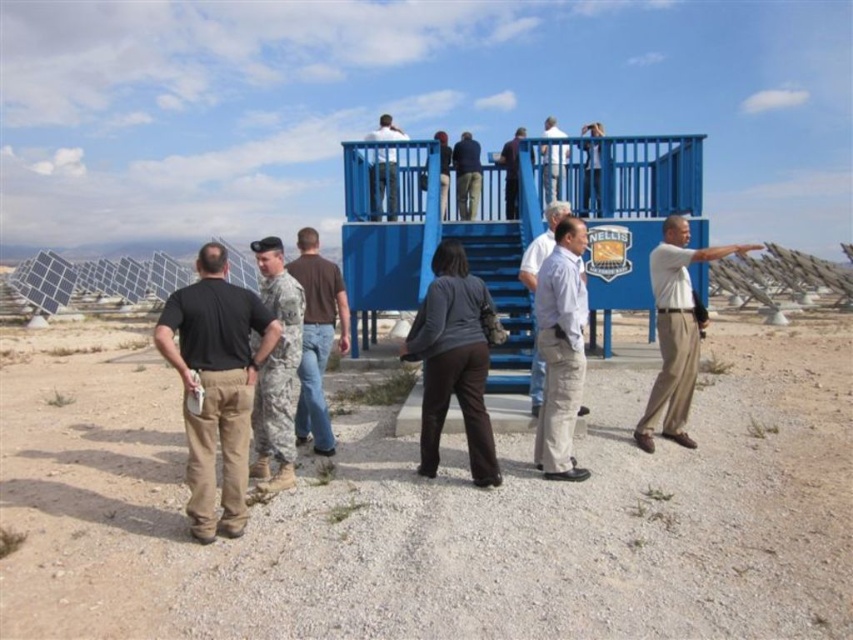
Is point (547, 124) closer to camera compared to point (514, 136)?

Yes.

Between point (550, 161) and point (514, 138), which one is positioned behind?

Point (514, 138)

In order to click on white shirt at upper center in this screenshot , I will do click(553, 170).

Does brown cotton shirt at center appear under white shirt at upper center?

Yes, brown cotton shirt at center is below white shirt at upper center.

Can you confirm if brown cotton shirt at center is wider than white shirt at upper center?

No, brown cotton shirt at center is not wider than white shirt at upper center.

What do you see at coordinates (317, 337) in the screenshot?
I see `brown cotton shirt at center` at bounding box center [317, 337].

Find the location of a particular element. The height and width of the screenshot is (640, 853). brown cotton shirt at center is located at coordinates (317, 337).

Who is higher up, beige cotton pants at right or matte white shirt at upper center?

matte white shirt at upper center

Who is positioned more to the right, beige cotton pants at right or matte white shirt at upper center?

beige cotton pants at right

Between point (656, 326) and point (372, 172), which one is positioned in front?

Point (656, 326)

Identify the location of beige cotton pants at right. This screenshot has height=640, width=853. (676, 330).